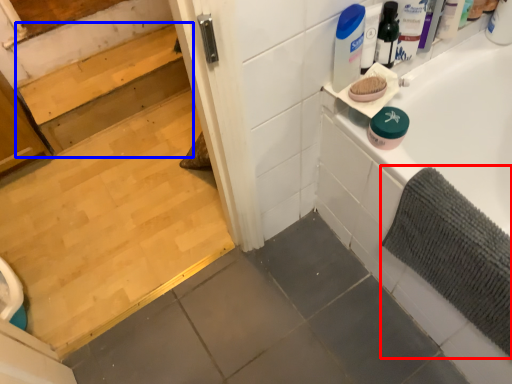
Question: Among these objects, which one is nearest to the camera, bath mat (highlighted by a red box) or stair (highlighted by a blue box)?

Choices:
 (A) bath mat
 (B) stair

Answer: (A)